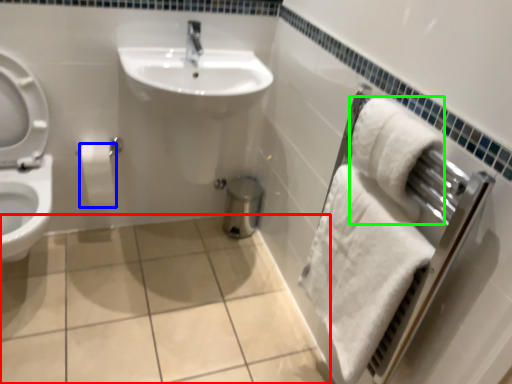
Question: Considering the real-world distances, which object is farthest from ceramic tile (highlighted by a red box)? toilet paper (highlighted by a blue box) or bath towel (highlighted by a green box)?

Choices:
 (A) toilet paper
 (B) bath towel

Answer: (B)